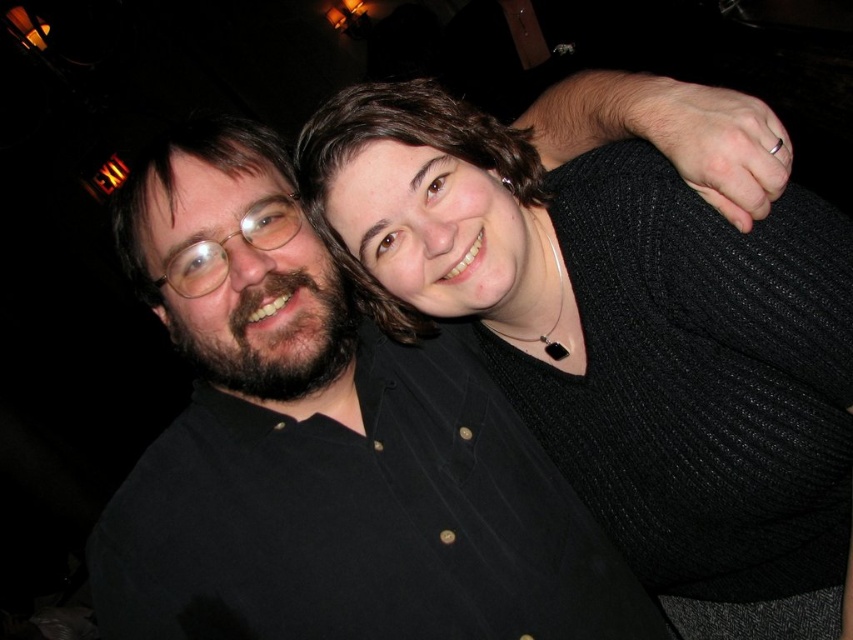
Who is shorter, black knitted sweater at upper right or black matte shirt at center?

black knitted sweater at upper right

Is black knitted sweater at upper right positioned in front of black matte shirt at center?

Yes, black knitted sweater at upper right is in front of black matte shirt at center.

Locate an element on the screen. black knitted sweater at upper right is located at coordinates (x=618, y=326).